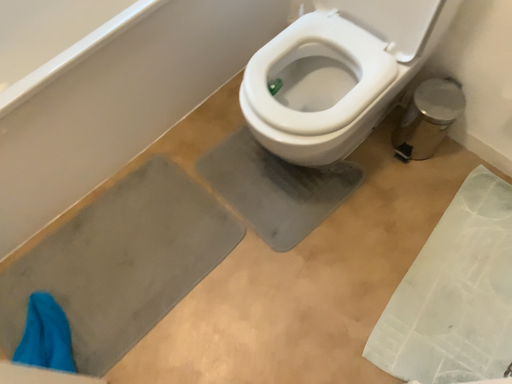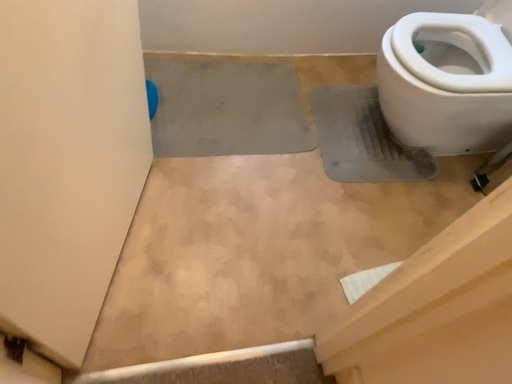
Question: How did the camera likely rotate when shooting the video?

Choices:
 (A) rotated right
 (B) rotated left

Answer: (B)